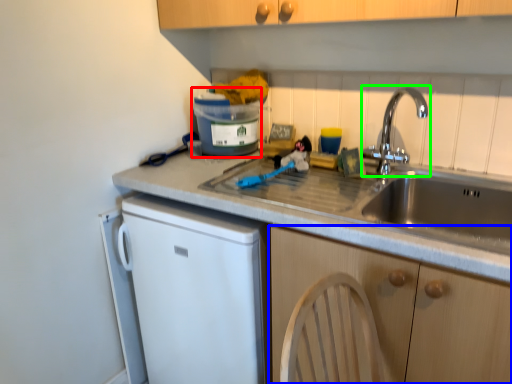
Question: Which object is the farthest from appliance (highlighted by a red box)? Choose among these: cabinetry (highlighted by a blue box) or tap (highlighted by a green box).

Choices:
 (A) cabinetry
 (B) tap

Answer: (A)